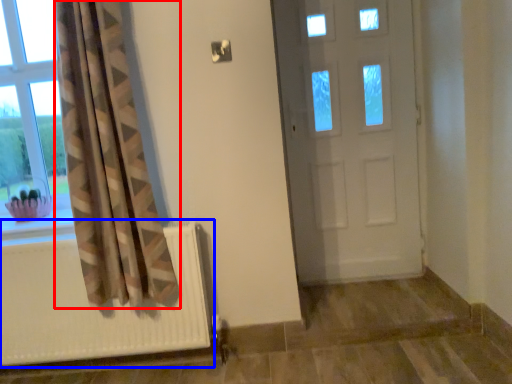
Question: Which point is closer to the camera, curtain (highlighted by a red box) or radiator (highlighted by a blue box)?

Choices:
 (A) curtain
 (B) radiator

Answer: (A)